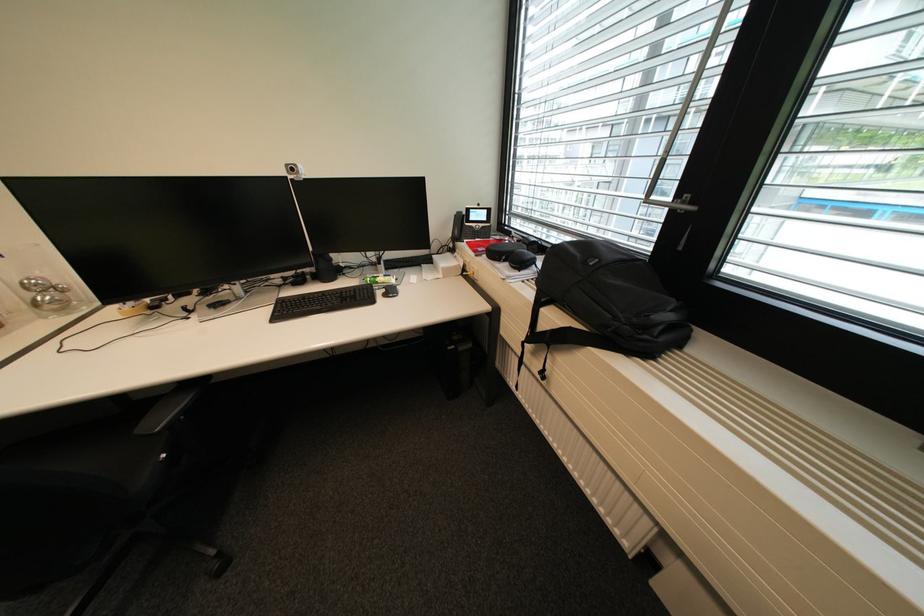
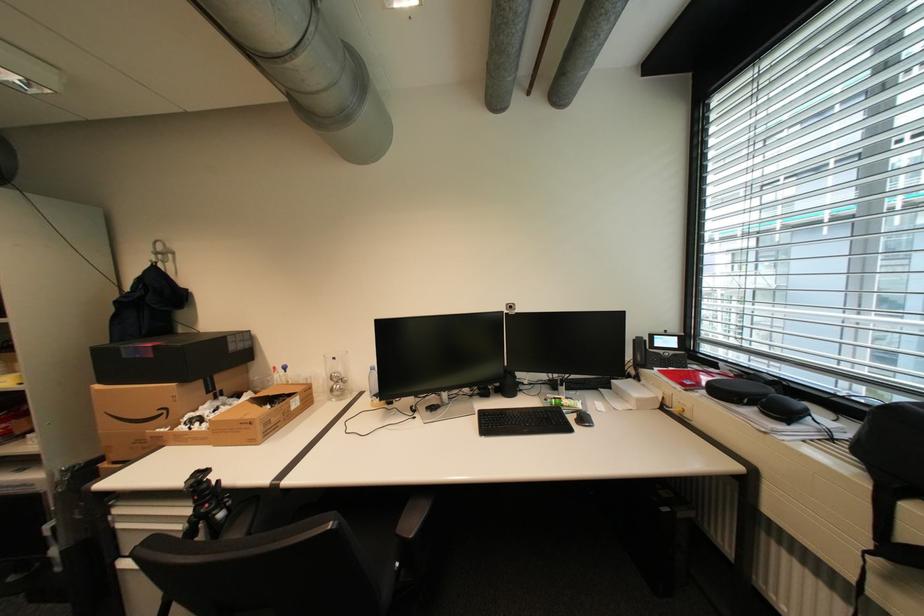
In the second image, find the point that corresponds to pixel 479 220 in the first image.

(664, 346)